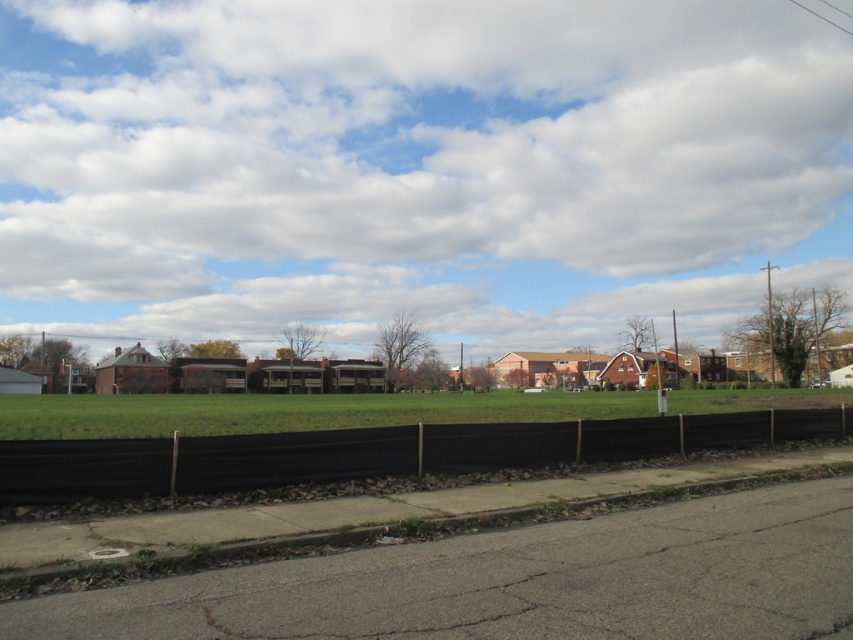
Question: In this image, where is white fluffy cloud at upper center located relative to gray concrete curb at lower center?

Choices:
 (A) below
 (B) above

Answer: (B)

Question: Which point appears closest to the camera in this image?

Choices:
 (A) (537, 436)
 (B) (201, 296)

Answer: (A)

Question: Observing the image, what is the correct spatial positioning of white fluffy cloud at upper center in reference to black plastic fence at lower center?

Choices:
 (A) left
 (B) right

Answer: (A)

Question: Among these objects, which one is farthest from the camera?

Choices:
 (A) white fluffy cloud at upper center
 (B) black plastic fence at lower center
 (C) gray concrete curb at lower center

Answer: (A)

Question: Considering the real-world distances, which object is farthest from the gray concrete curb at lower center?

Choices:
 (A) black plastic fence at lower center
 (B) white fluffy cloud at upper center

Answer: (B)

Question: Does white fluffy cloud at upper center have a greater width compared to black plastic fence at lower center?

Choices:
 (A) no
 (B) yes

Answer: (B)